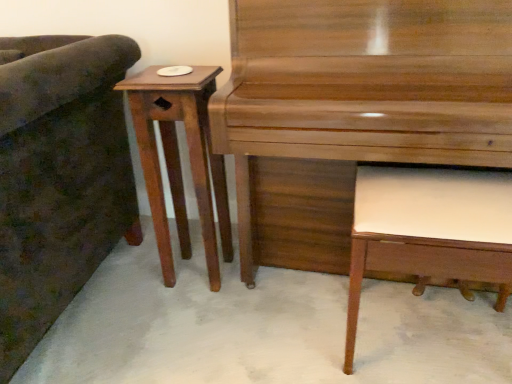
The height and width of the screenshot is (384, 512). Identify the location of vacant space that's between white leather music stool at lower right and shiny brown piano at center. (298, 340).